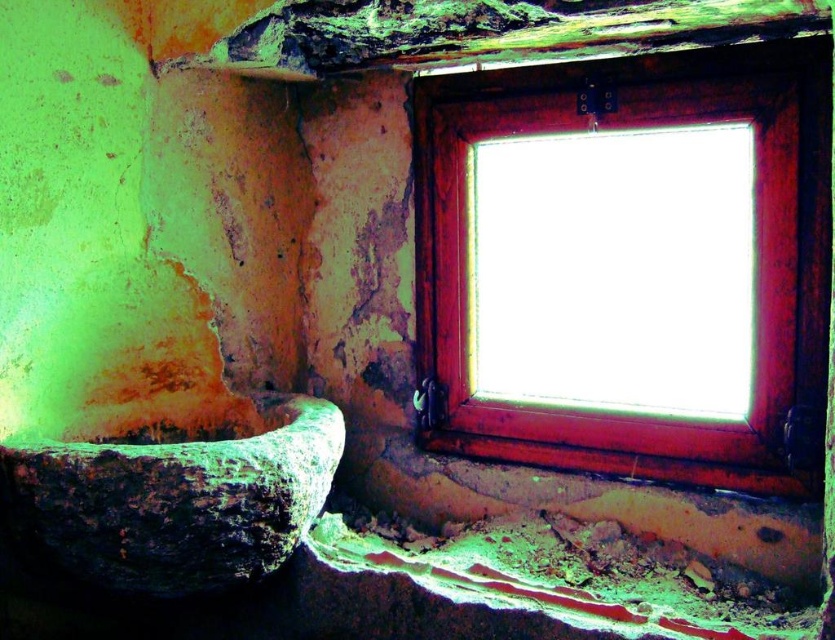
You are standing in the room and see a point marked at coordinates point (x=514, y=163). If you want to reach that point quickly, should you move towards the window or away from it?

The point (x=514, y=163) is 6.59 feet from the viewer. Since the window is the only source of bright light in the room, moving towards the window would bring you closer to the illuminated area, which is where the point is located. Therefore, you should move towards the window to reach the point quickly.

You are a painter who wants to set up an easel between the rusty wood window at upper right and the rusty stone bath at lower left. The easel requires a minimum of 30 inches of space to be placed. Based on the scene, can you fit the easel between them?

The rusty wood window at upper right and rusty stone bath at lower left are 27.39 inches apart from each other. Since the easel requires at least 30 inches of space, it cannot be placed between them as the available space is insufficient.

You are a painter who wants to place a 1.2 meter wide canvas in this room. You have two options for placement near the rusty wood window at upper right or the rusty stone bath at lower left. Based on their widths, which location can accommodate the canvas without it overlapping the objects?

The rusty wood window at upper right has a greater width than the rusty stone bath at lower left. Since the canvas is 1.2 meters wide, the rusty wood window at upper right is the better option as its width can accommodate the canvas without overlapping.